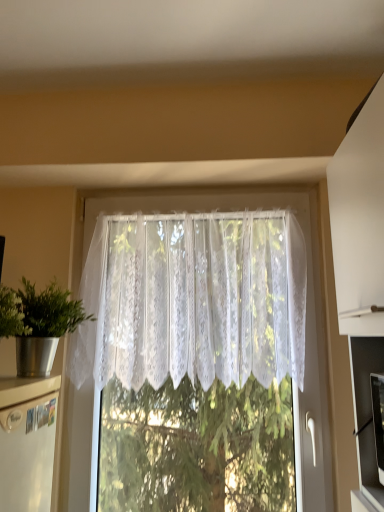
What do you see at coordinates (193, 300) in the screenshot? I see `white lace curtain at center` at bounding box center [193, 300].

The height and width of the screenshot is (512, 384). Find the location of `white lace curtain at center`. white lace curtain at center is located at coordinates (193, 300).

This screenshot has height=512, width=384. Describe the element at coordinates (38, 324) in the screenshot. I see `metallic silver pot at left` at that location.

You are a GUI agent. You are given a task and a screenshot of the screen. Output one action in this format:
    pyautogui.click(x=<x>, y=<y>)
    Task: Click on the metallic silver pot at left
    
    Given the screenshot: What is the action you would take?
    pyautogui.click(x=38, y=324)

I want to click on white lace curtain at center, so click(x=193, y=300).

Considering the relative positions of white lace curtain at center and metallic silver pot at left in the image provided, is white lace curtain at center to the left of metallic silver pot at left from the viewer's perspective?

In fact, white lace curtain at center is to the right of metallic silver pot at left.

Between white lace curtain at center and metallic silver pot at left, which one is positioned behind?

Positioned behind is white lace curtain at center.

Is point (121, 354) closer or farther from the camera than point (20, 307)?

Point (121, 354) is positioned farther from the camera compared to point (20, 307).

From the image's perspective, relative to metallic silver pot at left, is white lace curtain at center above or below?

white lace curtain at center is above metallic silver pot at left.

From a real-world perspective, is white lace curtain at center positioned under metallic silver pot at left based on gravity?

Actually, white lace curtain at center is physically above metallic silver pot at left in the real world.

Is white lace curtain at center wider than metallic silver pot at left?

No, white lace curtain at center is not wider than metallic silver pot at left.

Is white lace curtain at center shorter than metallic silver pot at left?

No.

Can you confirm if white lace curtain at center is smaller than metallic silver pot at left?

Incorrect, white lace curtain at center is not smaller in size than metallic silver pot at left.

Is white lace curtain at center located outside metallic silver pot at left?

Absolutely, white lace curtain at center is external to metallic silver pot at left.

Would you say white lace curtain at center is a long distance from metallic silver pot at left?

white lace curtain at center is near metallic silver pot at left, not far away.

Does white lace curtain at center turn towards metallic silver pot at left?

Yes, white lace curtain at center is aimed at metallic silver pot at left.

Looking at this image, how many degrees apart are the facing directions of white lace curtain at center and metallic silver pot at left?

They differ by 87.7 degrees in their facing directions.

Where is `houseplant below the white lace curtain at center (from the image's perspective)`? Image resolution: width=384 pixels, height=512 pixels. houseplant below the white lace curtain at center (from the image's perspective) is located at coordinates (38, 324).

In the image, is metallic silver pot at left on the left side or the right side of white lace curtain at center?

metallic silver pot at left is to the left of white lace curtain at center.

In the image, is metallic silver pot at left positioned in front of or behind white lace curtain at center?

In the image, metallic silver pot at left appears in front of white lace curtain at center.

Is point (19, 304) closer to camera compared to point (275, 257)?

Yes.

From the image's perspective, does metallic silver pot at left appear lower than white lace curtain at center?

Correct, metallic silver pot at left appears lower than white lace curtain at center in the image.

From a real-world perspective, does metallic silver pot at left sit lower than white lace curtain at center?

Yes.

Is metallic silver pot at left wider than white lace curtain at center?

Correct, the width of metallic silver pot at left exceeds that of white lace curtain at center.

Is metallic silver pot at left shorter than white lace curtain at center?

Correct, metallic silver pot at left is not as tall as white lace curtain at center.

Is metallic silver pot at left bigger than white lace curtain at center?

Incorrect, metallic silver pot at left is not larger than white lace curtain at center.

Is metallic silver pot at left inside the boundaries of white lace curtain at center, or outside?

metallic silver pot at left is located beyond the bounds of white lace curtain at center.

Would you say metallic silver pot at left is a long distance from white lace curtain at center?

metallic silver pot at left is actually quite close to white lace curtain at center.

Is metallic silver pot at left looking in the opposite direction of white lace curtain at center?

No.

Can you tell me how much metallic silver pot at left and white lace curtain at center differ in facing direction?

The angle between the facing direction of metallic silver pot at left and the facing direction of white lace curtain at center is 87.7 degrees.

Identify the location of curtain behind the metallic silver pot at left. The image size is (384, 512). (193, 300).

Identify the location of houseplant that is below the white lace curtain at center (from the image's perspective). This screenshot has height=512, width=384. (38, 324).

At what (x,y) coordinates should I click in order to perform the action: click on curtain that appears on the right of metallic silver pot at left. Please return your answer as a coordinate pair (x, y). Looking at the image, I should click on (193, 300).